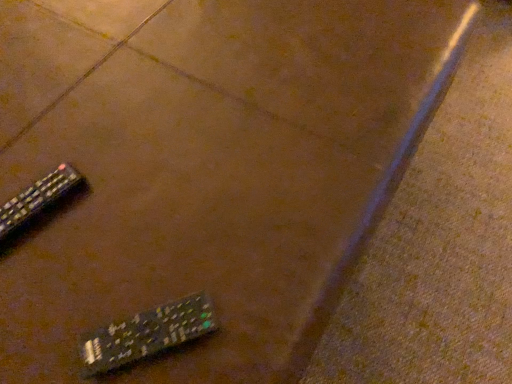
This screenshot has width=512, height=384. I want to click on free point in front of black plastic remote at lower left, which is the 1th remote control from back to front, so click(x=40, y=299).